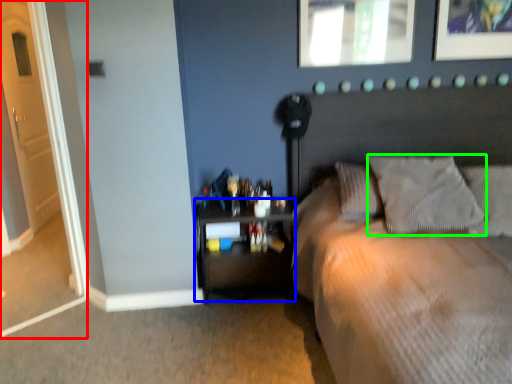
Question: Estimate the real-world distances between objects in this image. Which object is farther from door (highlighted by a red box), nightstand (highlighted by a blue box) or pillow (highlighted by a green box)?

Choices:
 (A) nightstand
 (B) pillow

Answer: (B)